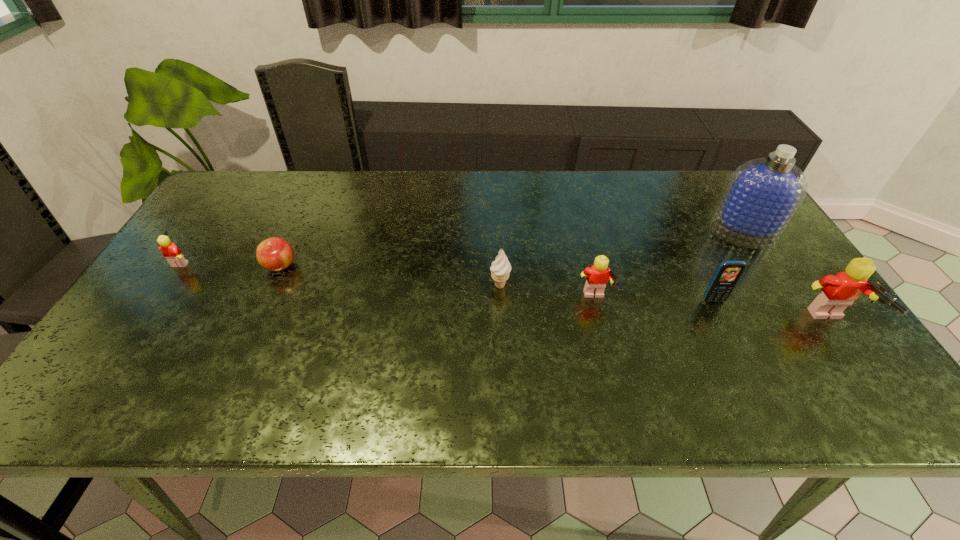
Locate an element on the screen. Lego present at the right edge is located at coordinates (839, 291).

Identify the location of cleansing agent that is at the right edge. (763, 194).

The width and height of the screenshot is (960, 540). What are the coordinates of `object that is positioned at the near right corner` in the screenshot? It's located at (839, 291).

In the image, there is a desktop. Identify the location of blank space at the far edge. This screenshot has width=960, height=540. (641, 203).

In the image, there is a desktop. At what (x,y) coordinates should I click in order to perform the action: click on vacant space at the left edge. Please return your answer as a coordinate pair (x, y). The height and width of the screenshot is (540, 960). Looking at the image, I should click on (196, 264).

The height and width of the screenshot is (540, 960). Identify the location of vacant space at the far left corner of the desktop. (252, 198).

Where is `free space at the near left corner of the desktop`? Image resolution: width=960 pixels, height=540 pixels. free space at the near left corner of the desktop is located at coordinates pos(119,355).

Identify the location of vacant space at the far right corner. (716, 172).

At what (x,y) coordinates should I click in order to perform the action: click on empty location between the fourth object from right to left and the shortest object. Please return your answer as a coordinate pair (x, y). Image resolution: width=960 pixels, height=540 pixels. Looking at the image, I should click on (438, 283).

Locate an element on the screen. This screenshot has height=540, width=960. free space between the leftmost object and the icecream is located at coordinates (341, 273).